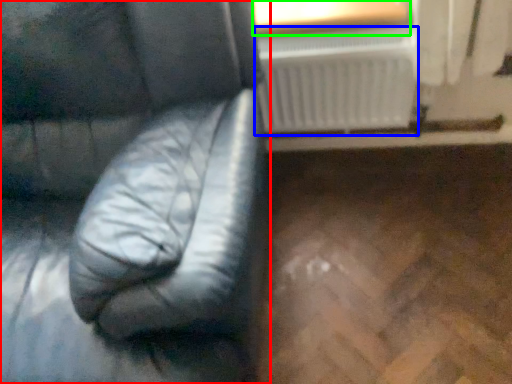
Question: Considering the real-world distances, which object is closest to furniture (highlighted by a red box)? radiator (highlighted by a blue box) or window frame (highlighted by a green box).

Choices:
 (A) radiator
 (B) window frame

Answer: (A)